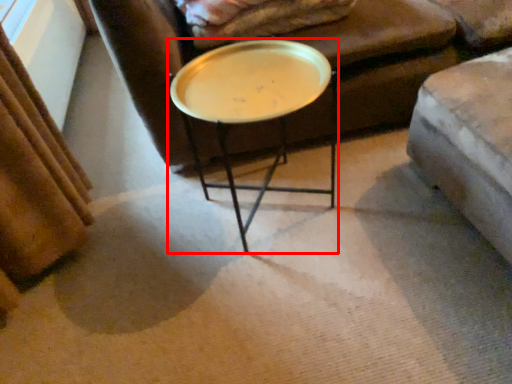
Question: From the image's perspective, where is coffee table (annotated by the red box) located relative to blanket?

Choices:
 (A) above
 (B) below

Answer: (B)